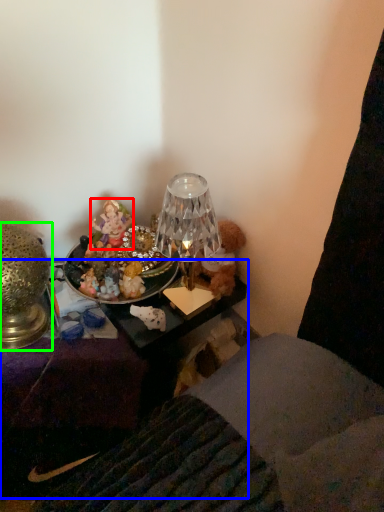
Question: Estimate the real-world distances between objects in this image. Which object is closer to person (highlighted by a red box), furniture (highlighted by a blue box) or lamp (highlighted by a green box)?

Choices:
 (A) furniture
 (B) lamp

Answer: (B)